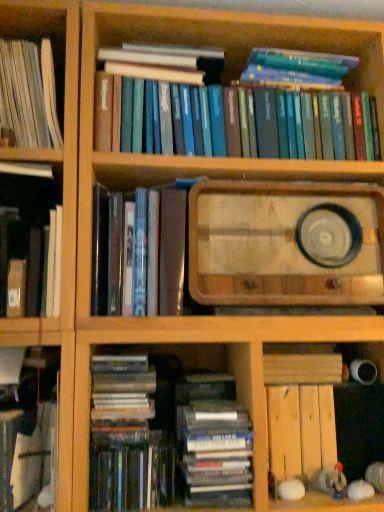
Image resolution: width=384 pixels, height=512 pixels. In order to click on hardcover books at lower center, which appears as the 5th book when viewed from the top in this screenshot , I will do `click(216, 453)`.

This screenshot has height=512, width=384. Describe the element at coordinates (131, 470) in the screenshot. I see `hardcover book at lower center, the 8th book viewed from the top` at that location.

Find the location of `hardcover book at left, the 5th book from the bottom`. hardcover book at left, the 5th book from the bottom is located at coordinates (x=33, y=245).

This screenshot has height=512, width=384. What do you see at coordinates (301, 407) in the screenshot?
I see `wooden plank at lower right, which ranks as the third book in bottom-to-top order` at bounding box center [301, 407].

Find the location of a particular element. This screenshot has height=512, width=384. matte black book at center, the third book from the top is located at coordinates (158, 252).

In order to face matte black book at center, arranged as the sixth book when ordered from the bottom, should I rotate leftwards or rightwards?

Rotate left and turn 6.594 degrees.

In order to face wooden radio at center, should I rotate leftwards or rightwards?

You should look right and rotate roughly 10.581 degrees.

Find the location of a particular element. The width and height of the screenshot is (384, 512). hardcover books at upper center, positioned as the 2th book in top-to-bottom order is located at coordinates (251, 114).

Which of these two, white paper book at left, which is the eighth book from bottom to top, or wooden radio at center, is wider?

Wider between the two is wooden radio at center.

Would you say white paper book at left, which ranks as the first book in top-to-bottom order, is outside wooden radio at center?

Yes, white paper book at left, which ranks as the first book in top-to-bottom order, is outside of wooden radio at center.

Which of these two, white paper book at left, which ranks as the first book in top-to-bottom order, or wooden radio at center, is bigger?

With larger size is wooden radio at center.

Is white paper book at left, which is the eighth book from bottom to top, oriented towards wooden radio at center?

No, white paper book at left, which is the eighth book from bottom to top, is not turned towards wooden radio at center.

Can white paper book at left, which is the eighth book from bottom to top, be found inside hardcover book at lower center, the first book in the bottom-to-top sequence?

No, white paper book at left, which is the eighth book from bottom to top, is not surrounded by hardcover book at lower center, the first book in the bottom-to-top sequence.

Can you confirm if hardcover book at lower center, the first book in the bottom-to-top sequence, is smaller than white paper book at left, which ranks as the first book in top-to-bottom order?

Indeed, hardcover book at lower center, the first book in the bottom-to-top sequence, has a smaller size compared to white paper book at left, which ranks as the first book in top-to-bottom order.

Does hardcover book at lower center, the 8th book viewed from the top, have a greater height compared to white paper book at left, which ranks as the first book in top-to-bottom order?

No, hardcover book at lower center, the 8th book viewed from the top, is not taller than white paper book at left, which ranks as the first book in top-to-bottom order.

Considering the positions of objects hardcover book at lower center, the first book in the bottom-to-top sequence, and white paper book at left, which ranks as the first book in top-to-bottom order, in the image provided, who is more to the right, hardcover book at lower center, the first book in the bottom-to-top sequence, or white paper book at left, which ranks as the first book in top-to-bottom order,?

Positioned to the right is hardcover book at lower center, the first book in the bottom-to-top sequence.

Are hardcover books at lower center, which appears as the 5th book when viewed from the top, and wooden radio at center far apart?

They are positioned close to each other.

Who is shorter, hardcover books at lower center, which appears as the 5th book when viewed from the top, or wooden radio at center?

hardcover books at lower center, which appears as the 5th book when viewed from the top.

Which is more to the right, hardcover books at lower center, placed as the fourth book when sorted from bottom to top, or wooden radio at center?

Positioned to the right is wooden radio at center.

Considering the relative sizes of hardcover books at lower center, which appears as the 5th book when viewed from the top, and wooden radio at center in the image provided, is hardcover books at lower center, which appears as the 5th book when viewed from the top, wider than wooden radio at center?

Yes, hardcover books at lower center, which appears as the 5th book when viewed from the top, is wider than wooden radio at center.

Is point (275, 347) closer or farther from the camera than point (215, 461)?

Point (275, 347) is farther from the camera than point (215, 461).

Is wooden plank at lower right, which is the sixth book in top-to-bottom order, facing towards hardcover books at lower center, which appears as the 5th book when viewed from the top?

No, wooden plank at lower right, which is the sixth book in top-to-bottom order, is not facing towards hardcover books at lower center, which appears as the 5th book when viewed from the top.

Is wooden plank at lower right, which ranks as the third book in bottom-to-top order, with hardcover books at lower center, placed as the fourth book when sorted from bottom to top?

No, wooden plank at lower right, which ranks as the third book in bottom-to-top order, is not in contact with hardcover books at lower center, placed as the fourth book when sorted from bottom to top.

Consider the image. Is hardcover books at lower center, placed as the fourth book when sorted from bottom to top, a part of wooden plank at lower right, which is the sixth book in top-to-bottom order?

No.

Who is shorter, hardcover books at lower center, placed as the fourth book when sorted from bottom to top, or hardcover book at lower left, which appears as the 7th book when viewed from the top?

Standing shorter between the two is hardcover book at lower left, which appears as the 7th book when viewed from the top.

Is the depth of hardcover books at lower center, which appears as the 5th book when viewed from the top, less than that of hardcover book at lower left, which appears as the 7th book when viewed from the top?

No, it is not.

Can we say hardcover books at lower center, which appears as the 5th book when viewed from the top, lies outside hardcover book at lower left, arranged as the 2th book when ordered from the bottom?

hardcover books at lower center, which appears as the 5th book when viewed from the top, lies outside hardcover book at lower left, arranged as the 2th book when ordered from the bottom,'s area.

Is point (229, 457) closer or farther from the camera than point (47, 426)?

Clearly, point (229, 457) is closer to the camera than point (47, 426).

Considering their positions, is hardcover book at left, the 5th book from the bottom, located in front of or behind wooden radio at center?

Visually, hardcover book at left, the 5th book from the bottom, is located in front of wooden radio at center.

Which object is wider, hardcover book at left, the 5th book from the bottom, or wooden radio at center?

wooden radio at center is wider.

Which is correct: hardcover book at left, the 5th book from the bottom, is inside wooden radio at center, or outside of it?

hardcover book at left, the 5th book from the bottom, lies outside wooden radio at center.

Which of these two, hardcover book at left, the 5th book from the bottom, or wooden radio at center, is smaller?

With smaller size is hardcover book at left, the 5th book from the bottom.

From the image's perspective, who appears lower, hardcover book at lower center, the first book in the bottom-to-top sequence, or hardcover book at left, arranged as the 4th book when viewed from the top?

hardcover book at lower center, the first book in the bottom-to-top sequence, from the image's perspective.

Is hardcover book at left, the 5th book from the bottom, located within hardcover book at lower center, the 8th book viewed from the top?

No.

From a real-world perspective, is hardcover book at lower center, the first book in the bottom-to-top sequence, over hardcover book at left, the 5th book from the bottom?

Incorrect, from a real-world perspective, hardcover book at lower center, the first book in the bottom-to-top sequence, is lower than hardcover book at left, the 5th book from the bottom.

In the image, there is a white paper book at left, which is the eighth book from bottom to top. Find the location of `paperback book below it (from the image's perspective)`. paperback book below it (from the image's perspective) is located at coordinates (282, 244).

In order to click on the 2nd book behind the hardcover book at lower center, the 8th book viewed from the top in this screenshot , I will do `click(29, 94)`.

When comparing their distances from hardcover book at lower left, which appears as the 7th book when viewed from the top, does wooden plank at lower right, which is the sixth book in top-to-bottom order, or matte black book at center, the third book from the top, seem closer?

The object closer to hardcover book at lower left, which appears as the 7th book when viewed from the top, is matte black book at center, the third book from the top.

From the image, which object appears to be farther from hardcover book at lower center, the first book in the bottom-to-top sequence, wooden plank at lower right, which ranks as the third book in bottom-to-top order, or matte black book at center, the third book from the top?

Based on the image, matte black book at center, the third book from the top, appears to be further to hardcover book at lower center, the first book in the bottom-to-top sequence.

Which object lies nearer to the anchor point wooden plank at lower right, which ranks as the third book in bottom-to-top order, wooden radio at center or matte black book at center, the third book from the top?

The object closer to wooden plank at lower right, which ranks as the third book in bottom-to-top order, is wooden radio at center.

When comparing their distances from white paper book at left, which is the eighth book from bottom to top, does hardcover books at upper center, positioned as the 2th book in top-to-bottom order, or hardcover book at left, arranged as the 4th book when viewed from the top, seem closer?

Among the two, hardcover book at left, arranged as the 4th book when viewed from the top, is located nearer to white paper book at left, which is the eighth book from bottom to top.

Based on their spatial positions, is wooden radio at center or hardcover book at lower left, which appears as the 7th book when viewed from the top, closer to hardcover books at upper center, placed as the 7th book when sorted from bottom to top?

wooden radio at center.

Consider the image. Considering their positions, is hardcover books at upper center, positioned as the 2th book in top-to-bottom order, positioned further to wooden radio at center than hardcover book at lower left, arranged as the 2th book when ordered from the bottom?

hardcover book at lower left, arranged as the 2th book when ordered from the bottom, is positioned further to the anchor wooden radio at center.

Estimate the real-world distances between objects in this image. Which object is closer to wooden plank at lower right, which is the sixth book in top-to-bottom order, matte black book at center, the third book from the top, or hardcover books at upper center, placed as the 7th book when sorted from bottom to top?

matte black book at center, the third book from the top, is closer to wooden plank at lower right, which is the sixth book in top-to-bottom order.

Looking at the image, which one is located further to hardcover book at left, the 5th book from the bottom, wooden plank at lower right, which is the sixth book in top-to-bottom order, or wooden radio at center?

wooden plank at lower right, which is the sixth book in top-to-bottom order, is positioned further to the anchor hardcover book at left, the 5th book from the bottom.

The width and height of the screenshot is (384, 512). Identify the location of paperback book between hardcover book at left, arranged as the 4th book when viewed from the top, and wooden plank at lower right, which ranks as the third book in bottom-to-top order. click(282, 244).

Where is `paperback book situated between hardcover book at lower left, which appears as the 7th book when viewed from the top, and wooden plank at lower right, which is the sixth book in top-to-bottom order, from left to right`? This screenshot has width=384, height=512. paperback book situated between hardcover book at lower left, which appears as the 7th book when viewed from the top, and wooden plank at lower right, which is the sixth book in top-to-bottom order, from left to right is located at coordinates (282, 244).

The height and width of the screenshot is (512, 384). I want to click on paperback book between hardcover books at upper center, placed as the 7th book when sorted from bottom to top, and hardcover book at lower left, arranged as the 2th book when ordered from the bottom, vertically, so click(282, 244).

Locate an element on the screen. This screenshot has height=512, width=384. paperback book between white paper book at left, which ranks as the first book in top-to-bottom order, and hardcover book at lower center, the 8th book viewed from the top, in the up-down direction is located at coordinates (282, 244).